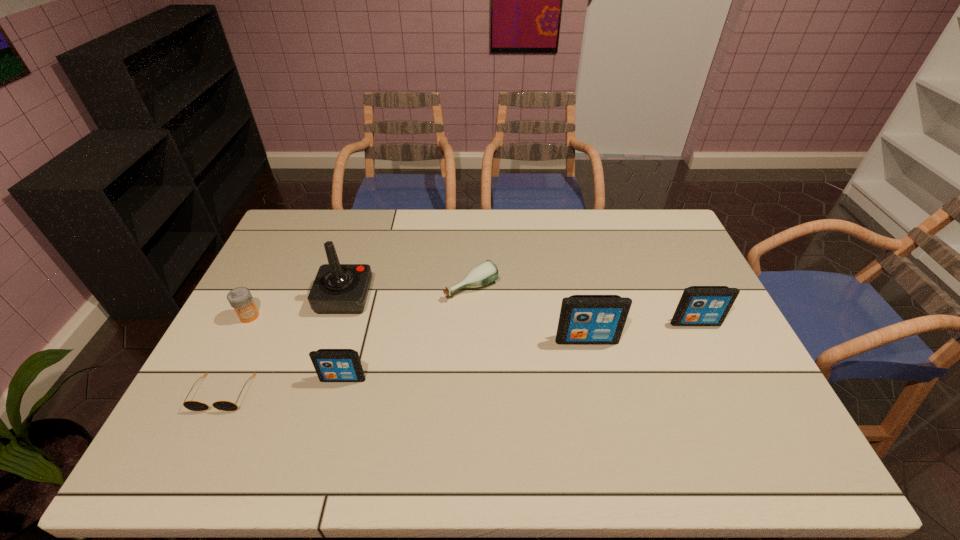
Find the location of a particular element. The height and width of the screenshot is (540, 960). the shortest object is located at coordinates (190, 405).

You are a GUI agent. You are given a task and a screenshot of the screen. Output one action in this format:
    pyautogui.click(x=<x>, y=<y>)
    Task: Click on the vacant space positioned on the front screen of the sixth object from left to right
    The image size is (960, 540).
    Given the screenshot: What is the action you would take?
    pyautogui.click(x=597, y=385)

Find the location of `free space located 0.090m on the front screen of the second tallest iPod`. free space located 0.090m on the front screen of the second tallest iPod is located at coordinates (709, 352).

This screenshot has width=960, height=540. I want to click on free location located 0.070m on the label side of the medicine, so click(236, 343).

Locate an element on the screen. This screenshot has width=960, height=540. vacant space situated on the front-facing side of the tallest object is located at coordinates 492,298.

I want to click on vacant space situated on the right of the third object from right to left, so pyautogui.click(x=517, y=287).

I want to click on object located at the near edge, so click(190, 405).

The width and height of the screenshot is (960, 540). In order to click on medicine that is at the left edge in this screenshot , I will do `click(240, 298)`.

Where is `sunglasses that is at the left edge`? This screenshot has width=960, height=540. sunglasses that is at the left edge is located at coordinates (190, 405).

Find the location of `object present at the right edge`. object present at the right edge is located at coordinates (699, 305).